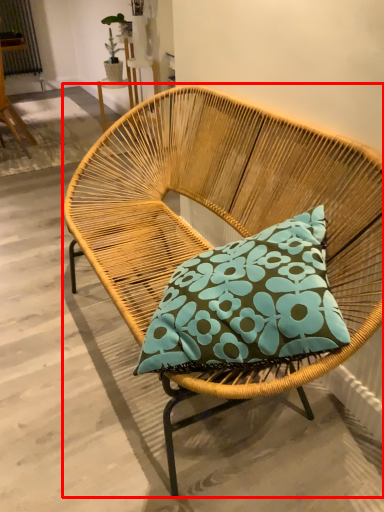
Question: In this image, where is chair (annotated by the red box) located relative to chair?

Choices:
 (A) right
 (B) left

Answer: (A)